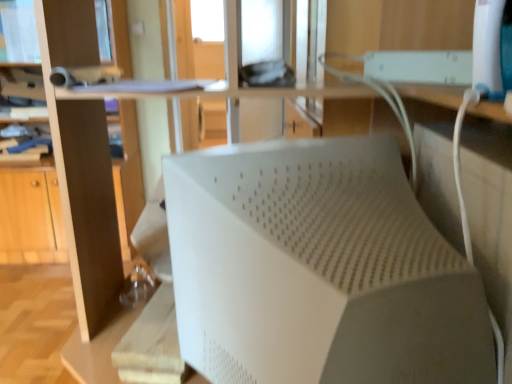
Question: Considering the relative positions of white matte speaker at center and matte brown bookshelf at left in the image provided, is white matte speaker at center to the left of matte brown bookshelf at left from the viewer's perspective?

Choices:
 (A) no
 (B) yes

Answer: (A)

Question: From a real-world perspective, is white matte speaker at center located higher than matte brown bookshelf at left?

Choices:
 (A) no
 (B) yes

Answer: (B)

Question: Are white matte speaker at center and matte brown bookshelf at left beside each other?

Choices:
 (A) yes
 (B) no

Answer: (B)

Question: Does white matte speaker at center have a smaller size compared to matte brown bookshelf at left?

Choices:
 (A) yes
 (B) no

Answer: (A)

Question: Can you confirm if white matte speaker at center is shorter than matte brown bookshelf at left?

Choices:
 (A) no
 (B) yes

Answer: (B)

Question: Would you say white matte speaker at center is a long distance from matte brown bookshelf at left?

Choices:
 (A) yes
 (B) no

Answer: (A)

Question: Does matte brown bookshelf at left have a lesser height compared to white matte speaker at center?

Choices:
 (A) yes
 (B) no

Answer: (B)

Question: Is matte brown bookshelf at left at the right side of white matte speaker at center?

Choices:
 (A) yes
 (B) no

Answer: (B)

Question: Can you see matte brown bookshelf at left touching white matte speaker at center?

Choices:
 (A) yes
 (B) no

Answer: (B)

Question: From a real-world perspective, is matte brown bookshelf at left under white matte speaker at center?

Choices:
 (A) no
 (B) yes

Answer: (B)

Question: Is white matte speaker at center located within matte brown bookshelf at left?

Choices:
 (A) yes
 (B) no

Answer: (B)

Question: Can you confirm if matte brown bookshelf at left is positioned to the left of white matte speaker at center?

Choices:
 (A) yes
 (B) no

Answer: (A)

Question: From a real-world perspective, relative to matte brown bookshelf at left, is white matte speaker at center vertically above or below?

Choices:
 (A) above
 (B) below

Answer: (A)